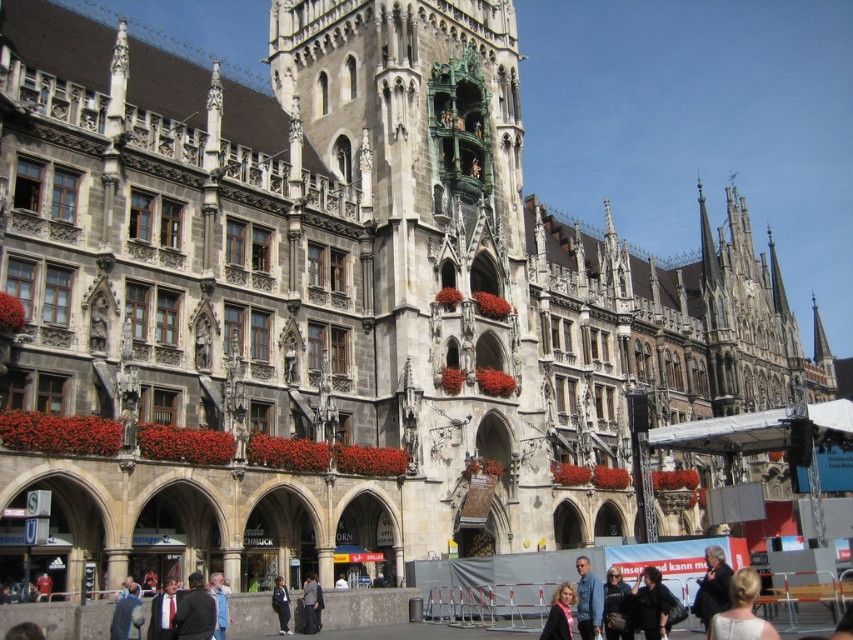
You are a photographer standing in front of the historic building. You see a white fabric dress at lower right and a black fabric jacket at lower center. Which clothing item is positioned more to the east side of the building?

The white fabric dress at lower right is positioned more to the east side of the building because it is to the right of the black fabric jacket at lower center.

You are an artist standing in front of the historic building and you want to sketch the white fabric dress at lower right and the black fabric jacket at lower center. Which object should you sketch first to maintain the correct spatial relationship between them?

You should sketch the white fabric dress at lower right first because it is in front of the black fabric jacket at lower center, so it should be drawn over the jacket to maintain the correct spatial relationship.

You are a visitor standing in front of the historic building. You see a dark suit at center and a blue denim jacket at lower right. Which clothing item is closer to the ground?

The dark suit at center is below the blue denim jacket at lower right, so the dark suit at center is closer to the ground.